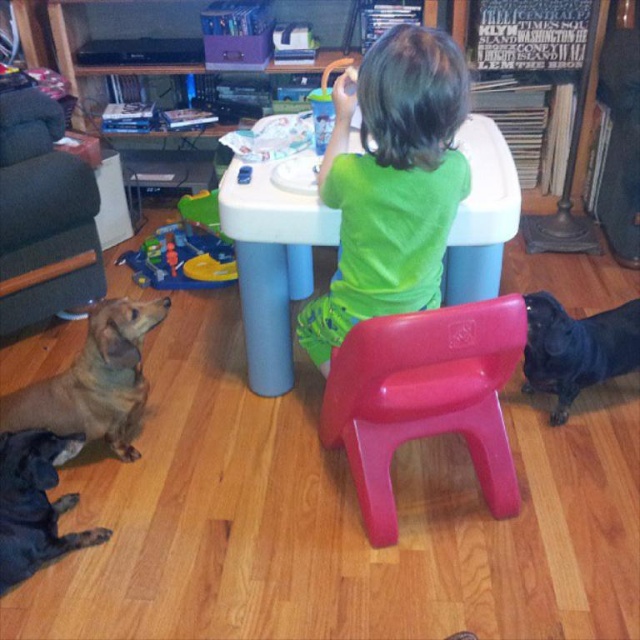
Question: Which point is closer to the camera?

Choices:
 (A) brown fur dog at lower left
 (B) soft fabric couch at left

Answer: (A)

Question: Among these points, which one is farthest from the camera?

Choices:
 (A) (116, 260)
 (B) (22, 280)
 (C) (97, 538)
 (D) (545, 392)

Answer: (A)

Question: Is red plastic stool at center below soft fabric couch at left?

Choices:
 (A) yes
 (B) no

Answer: (A)

Question: Among these objects, which one is nearest to the camera?

Choices:
 (A) green matte shirt at center
 (B) brown fur dog at lower left
 (C) soft fabric couch at left
 (D) blue plastic toy at center

Answer: (A)

Question: Is soft fabric couch at left above black smooth dog at lower left?

Choices:
 (A) yes
 (B) no

Answer: (A)

Question: Is red plastic stool at center smaller than blue plastic toy at center?

Choices:
 (A) no
 (B) yes

Answer: (A)